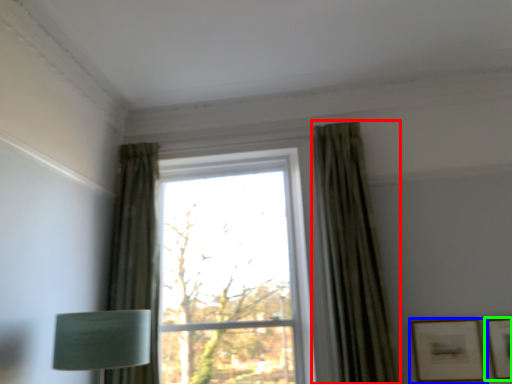
Question: Which object is positioned farthest from curtain (highlighted by a red box)? Select from picture frame (highlighted by a blue box) and picture frame (highlighted by a green box).

Choices:
 (A) picture frame
 (B) picture frame

Answer: (B)